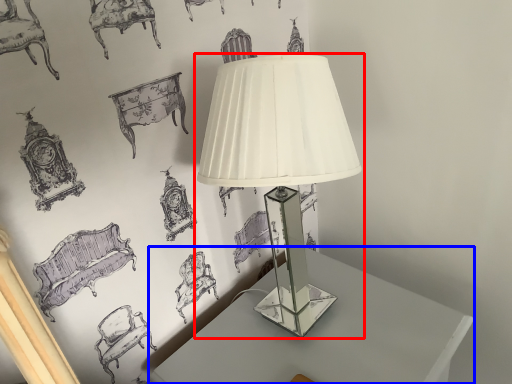
Question: Among these objects, which one is farthest to the camera, lamp (highlighted by a red box) or table (highlighted by a blue box)?

Choices:
 (A) lamp
 (B) table

Answer: (B)